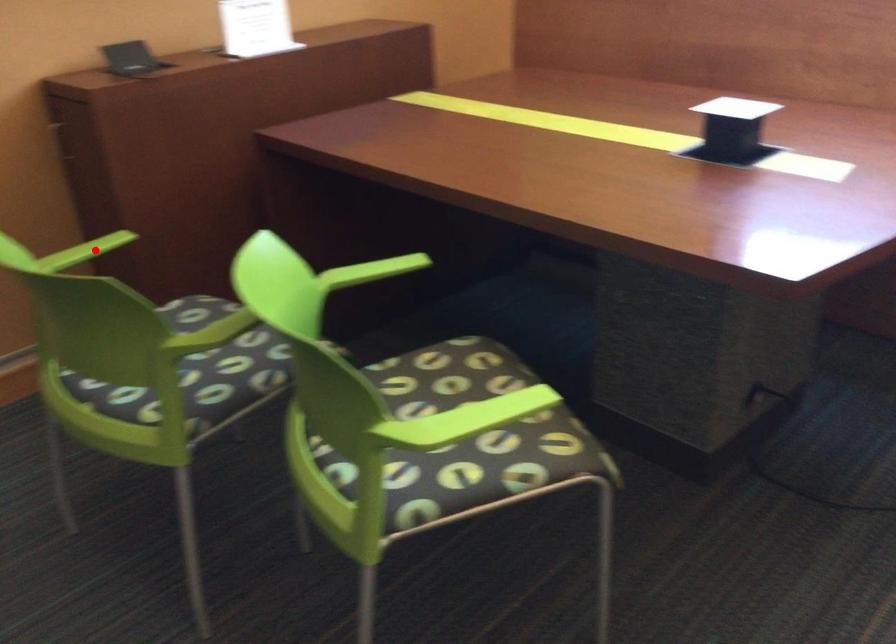
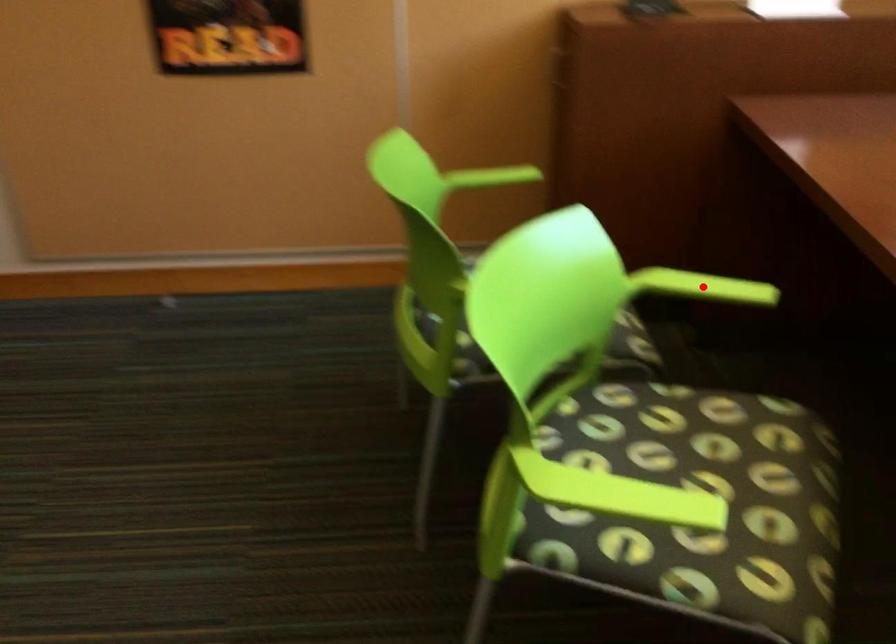
I am providing you with two images of the same scene from different viewpoints. A red point is marked on the first image and another point is marked on the second image. Is the red point in image1 aligned with the point shown in image2?

No